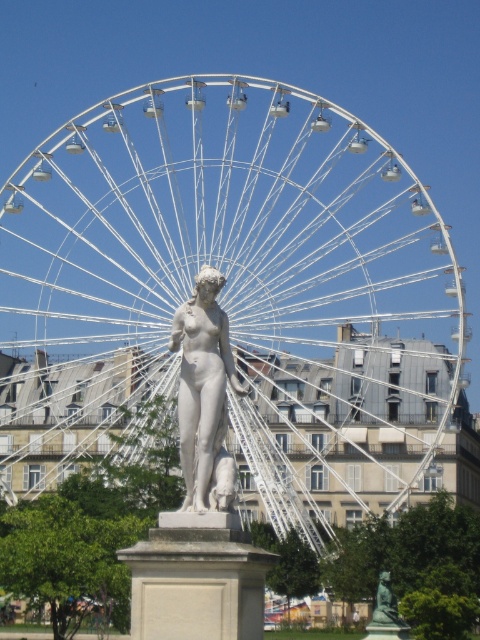
Is white metallic ferris wheel at center positioned at the back of white marble statue at center?

Yes, white metallic ferris wheel at center is further from the viewer.

Locate an element on the screen. This screenshot has height=640, width=480. white metallic ferris wheel at center is located at coordinates 240,296.

Between point (368, 390) and point (213, 304), which one is positioned behind?

The point (368, 390) is more distant.

The height and width of the screenshot is (640, 480). In order to click on white metallic ferris wheel at center in this screenshot , I will do `click(240, 296)`.